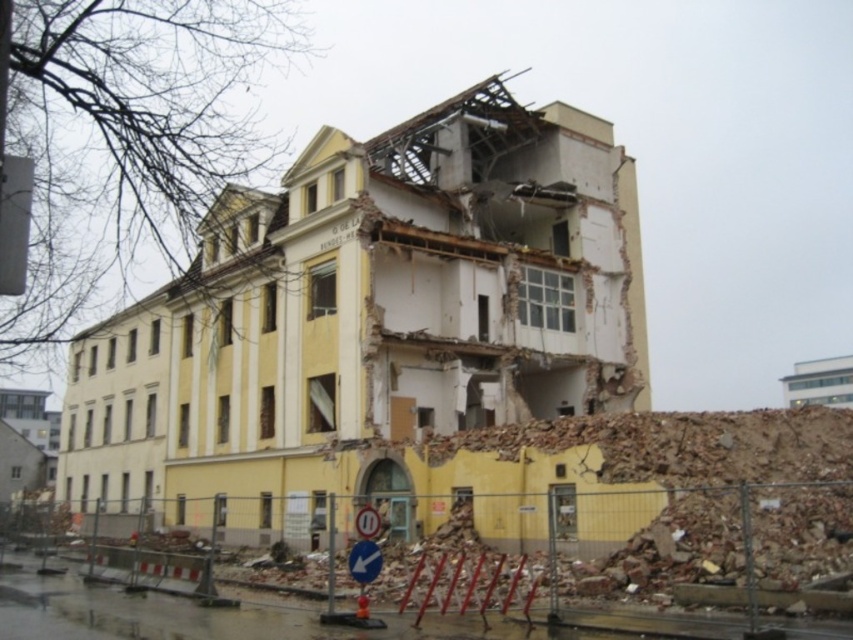
Who is lower down, yellow/white concrete building at center or crumbled concrete debris at center?

crumbled concrete debris at center

This screenshot has width=853, height=640. What do you see at coordinates (373, 326) in the screenshot? I see `yellow/white concrete building at center` at bounding box center [373, 326].

The image size is (853, 640). In order to click on yellow/white concrete building at center in this screenshot , I will do `click(373, 326)`.